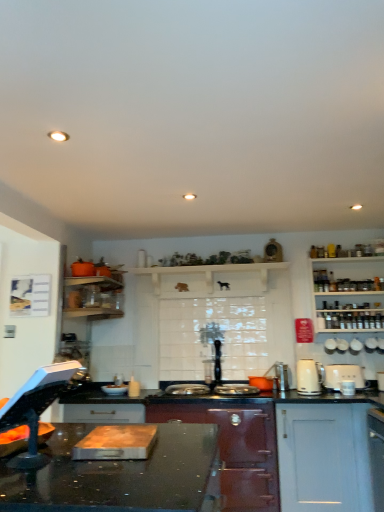
Question: From a real-world perspective, relative to white wooden shelves at right, is orange matte pot at center, placed as the 1th appliance when sorted from left to right, vertically above or below?

Choices:
 (A) above
 (B) below

Answer: (B)

Question: Is orange matte pot at center, positioned as the fifth appliance in right-to-left order, situated inside white wooden shelves at right or outside?

Choices:
 (A) inside
 (B) outside

Answer: (B)

Question: Which of these objects is positioned farthest from the white glossy kettle at center-right, placed as the 1th kitchen appliance when sorted from left to right?

Choices:
 (A) orange matte pot at center, placed as the 1th appliance when sorted from left to right
 (B) white ceramic toaster at upper right, placed as the third appliance when sorted from left to right
 (C) matte dark red stove at center, the second cabinetry viewed from the right
 (D) white ceramic cups at upper right, which is the fourth appliance in left-to-right order
 (E) white ceramic kettle at upper right, arranged as the 4th appliance when viewed from the right

Answer: (C)

Question: Which object is positioned closest to the white glossy kettle at center-right, placed as the 1th kitchen appliance when sorted from left to right?

Choices:
 (A) white ceramic cups at upper right, the second appliance when ordered from right to left
 (B) white ceramic toaster at upper right, arranged as the third appliance when viewed from the right
 (C) white matte cabinet at lower right, the first cabinetry from the right
 (D) white ceramic mug at upper right, arranged as the 1th appliance when viewed from the right
 (E) white wooden shelves at right

Answer: (B)